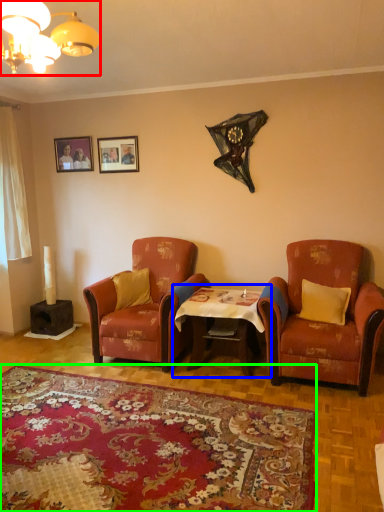
Question: Which is farther away from lamp (highlighted by a red box)? table (highlighted by a blue box) or plain (highlighted by a green box)?

Choices:
 (A) table
 (B) plain

Answer: (A)